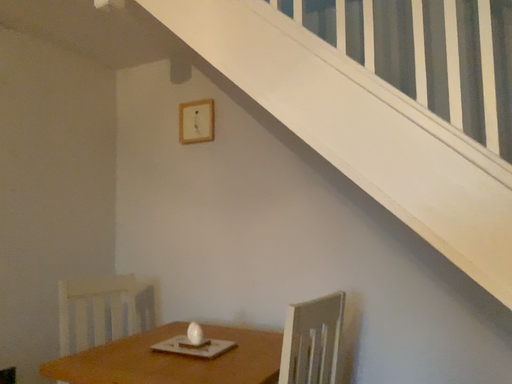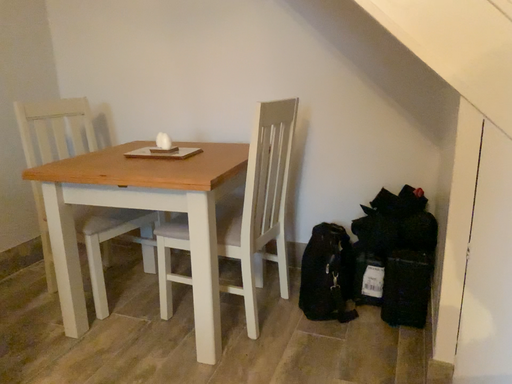
Question: Which way did the camera rotate in the video?

Choices:
 (A) rotated upward
 (B) rotated downward

Answer: (B)